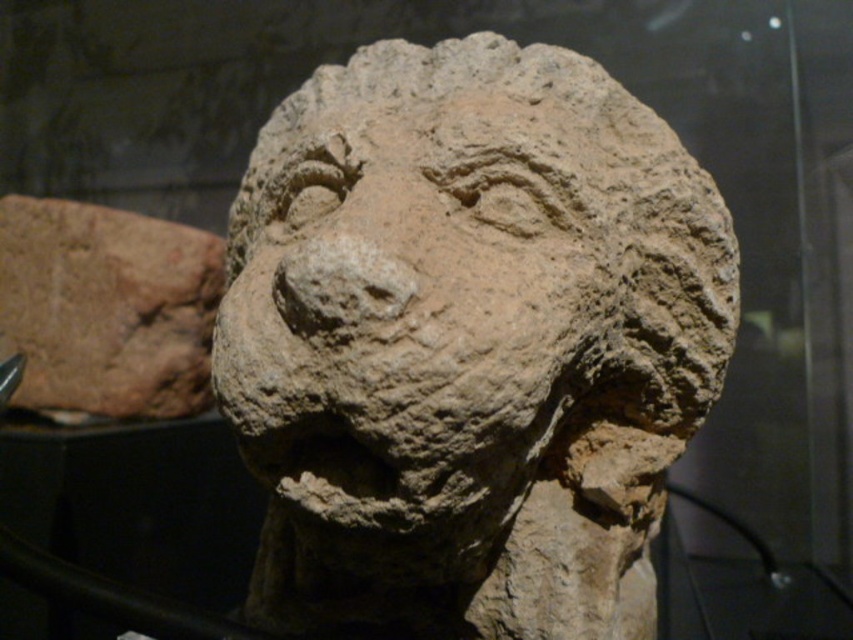
Can you confirm if earthen stone lion at center is positioned above brown clay head at left?

Actually, earthen stone lion at center is below brown clay head at left.

Locate an element on the screen. earthen stone lion at center is located at coordinates (468, 342).

Locate an element on the screen. The image size is (853, 640). earthen stone lion at center is located at coordinates (468, 342).